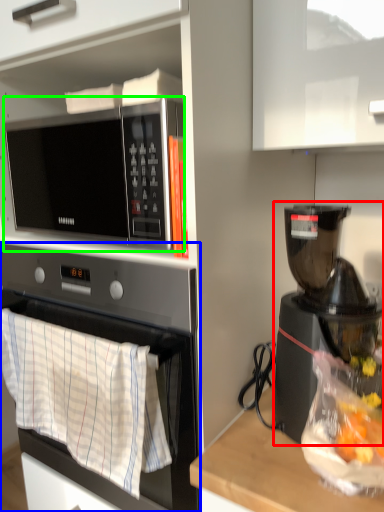
Question: Estimate the real-world distances between objects in this image. Which object is farther from coffee maker (highlighted by a red box), oven (highlighted by a blue box) or microwave oven (highlighted by a green box)?

Choices:
 (A) oven
 (B) microwave oven

Answer: (B)